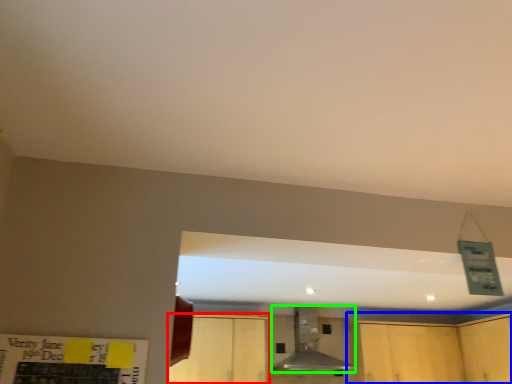
Question: Estimate the real-world distances between objects in this image. Which object is closer to cabinetry (highlighted by a red box), cabinetry (highlighted by a blue box) or vent (highlighted by a green box)?

Choices:
 (A) cabinetry
 (B) vent

Answer: (B)